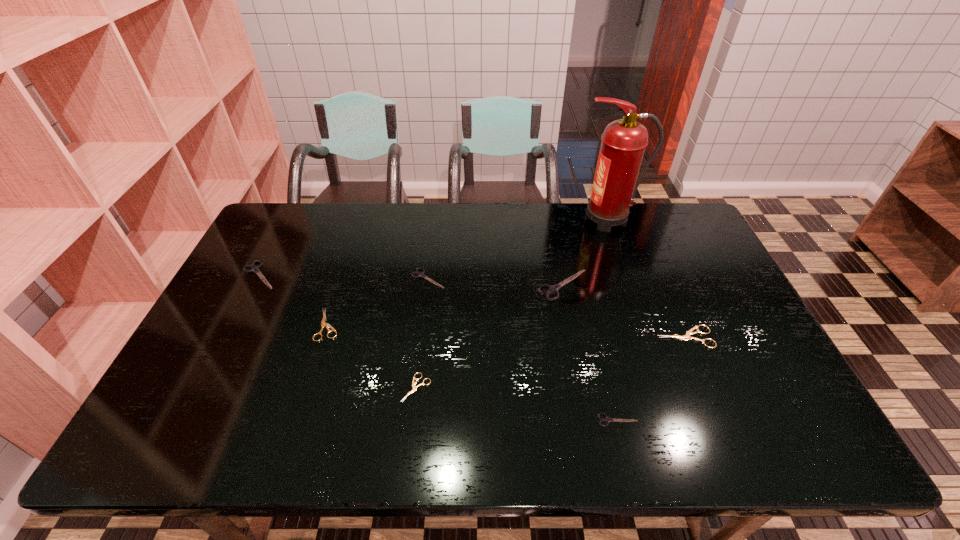
At what (x,y) coordinates should I click in order to perform the action: click on beige shears that is the third closest to the second smallest black shears. Please return your answer as a coordinate pair (x, y). This screenshot has width=960, height=540. Looking at the image, I should click on (687, 336).

Identify which beige shears is located as the second nearest to the fire extinguisher. Please provide its 2D coordinates. Your answer should be formatted as a tuple, i.e. [(x, y)], where the tuple contains the x and y coordinates of a point satisfying the conditions above.

[(414, 388)]

This screenshot has height=540, width=960. Identify the location of free location that satisfies the following two spatial constraints: 1. on the front side of the biggest black shears; 2. on the left side of the nearest shears. (588, 420).